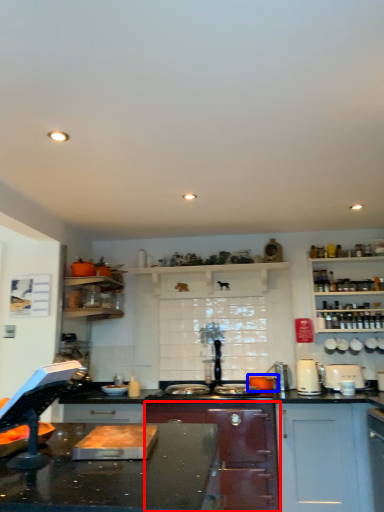
Question: Which of the following is the farthest to the observer, cabinetry (highlighted by a red box) or appliance (highlighted by a blue box)?

Choices:
 (A) cabinetry
 (B) appliance

Answer: (B)